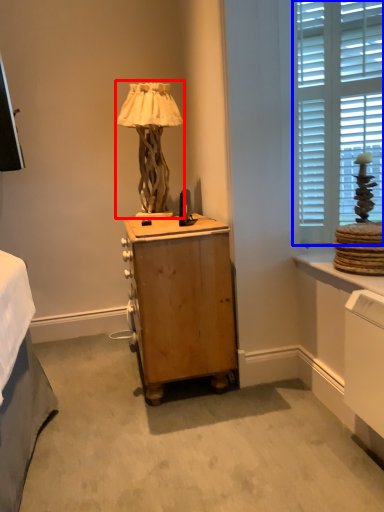
Question: Which of the following is the closest to the observer, table lamp (highlighted by a red box) or window (highlighted by a blue box)?

Choices:
 (A) table lamp
 (B) window

Answer: (B)